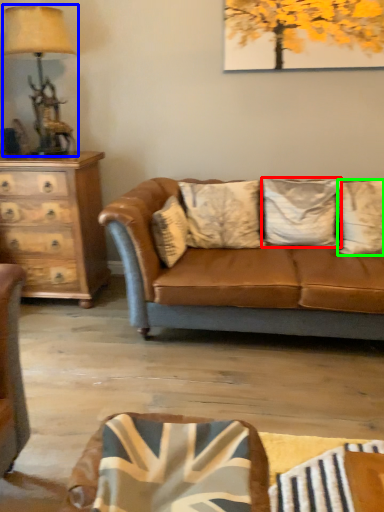
Question: Which is farther away from pillow (highlighted by a red box)? table lamp (highlighted by a blue box) or pillow (highlighted by a green box)?

Choices:
 (A) table lamp
 (B) pillow

Answer: (A)